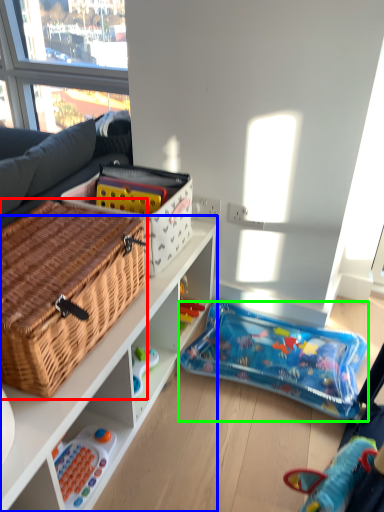
Question: Which object is the closest to the picnic basket (highlighted by a red box)? Choose among these: cabinetry (highlighted by a blue box) or toy (highlighted by a green box).

Choices:
 (A) cabinetry
 (B) toy

Answer: (A)